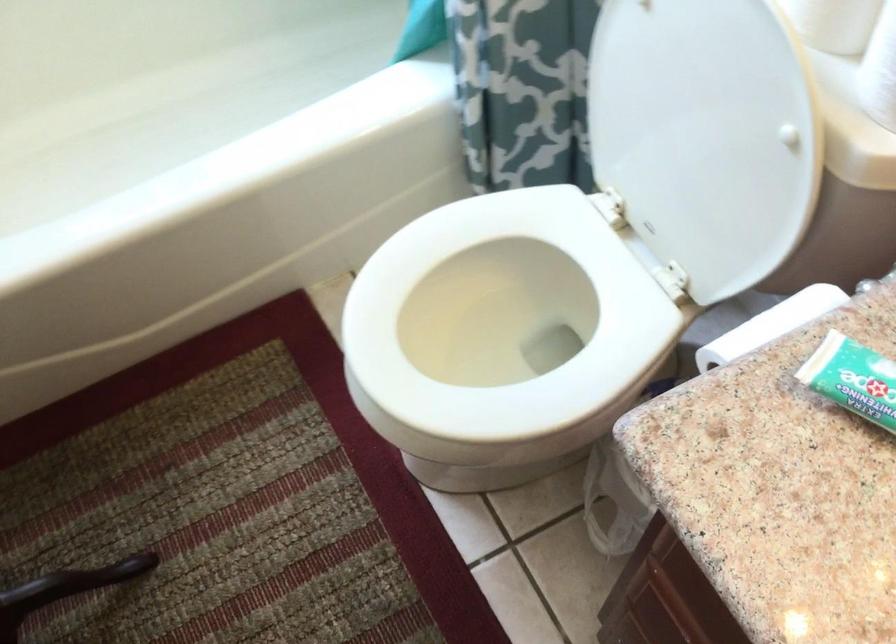
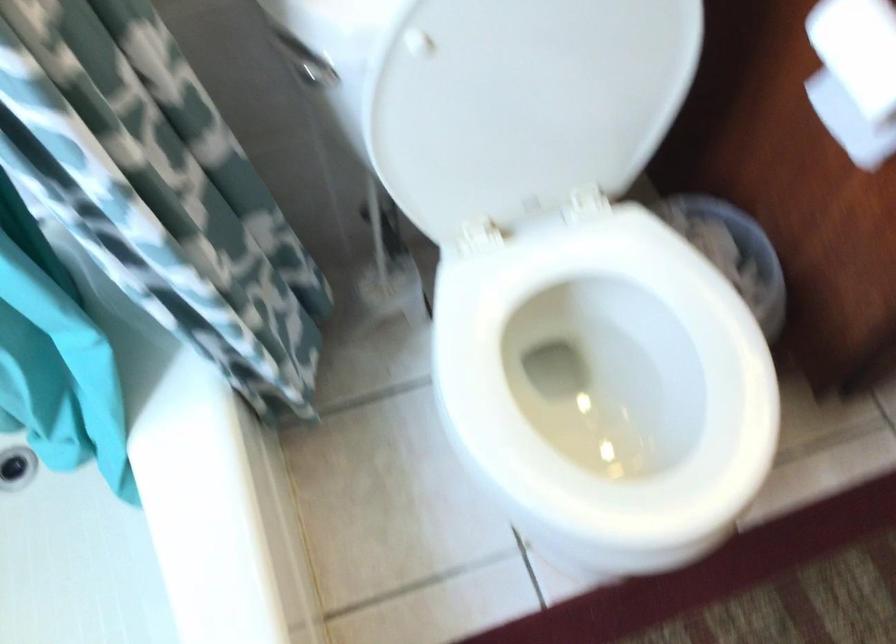
Find the pixel in the second image that matches point 547,386 in the first image.

(606, 375)